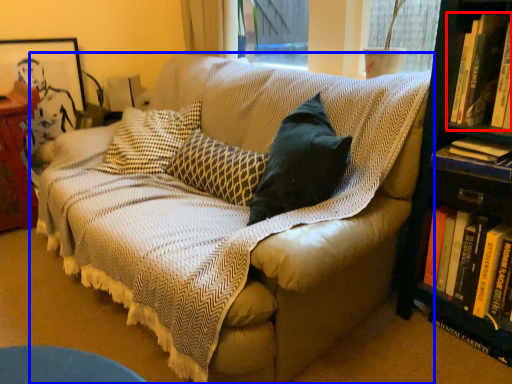
Question: Which object is closer to the camera taking this photo, book (highlighted by a red box) or studio couch (highlighted by a blue box)?

Choices:
 (A) book
 (B) studio couch

Answer: (B)